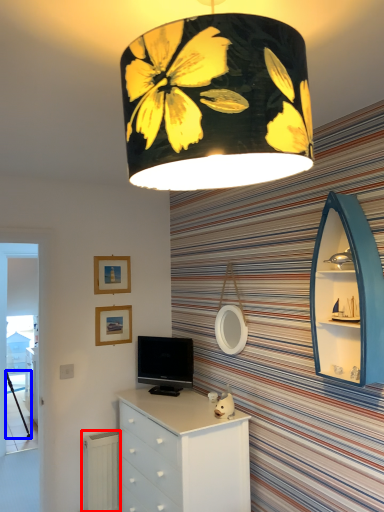
Question: Which object is further to the camera taking this photo, radiator (highlighted by a red box) or tripod (highlighted by a blue box)?

Choices:
 (A) radiator
 (B) tripod

Answer: (B)